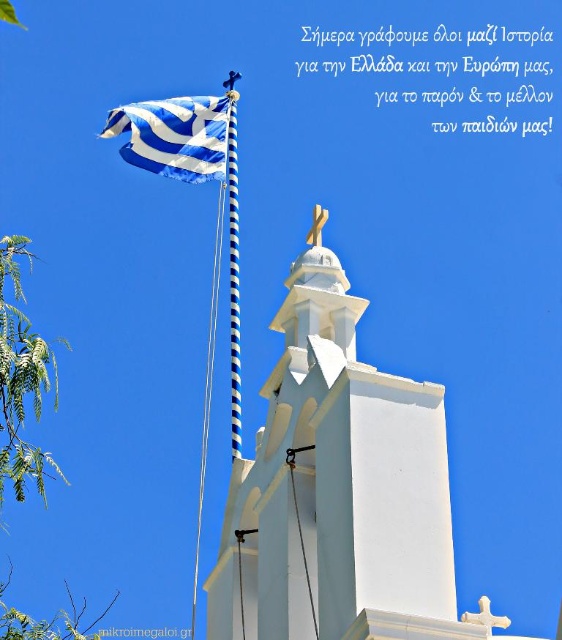
Question: Which object is closer to the camera taking this photo?

Choices:
 (A) blue and white striped flag at upper left
 (B) blue striped pole at upper center

Answer: (B)

Question: Which object is farther from the camera taking this photo?

Choices:
 (A) blue striped pole at upper center
 (B) white smooth tower at center
 (C) blue and white striped flag at upper left

Answer: (C)

Question: Which point appears closest to the camera in this image?

Choices:
 (A) (315, 454)
 (B) (153, 140)

Answer: (A)

Question: Can you confirm if white smooth tower at center is wider than blue and white striped flag at upper left?

Choices:
 (A) yes
 (B) no

Answer: (B)

Question: Is white smooth tower at center behind blue striped pole at upper center?

Choices:
 (A) no
 (B) yes

Answer: (A)

Question: From the image, what is the correct spatial relationship of blue and white striped flag at upper left in relation to blue striped pole at upper center?

Choices:
 (A) above
 (B) below

Answer: (A)